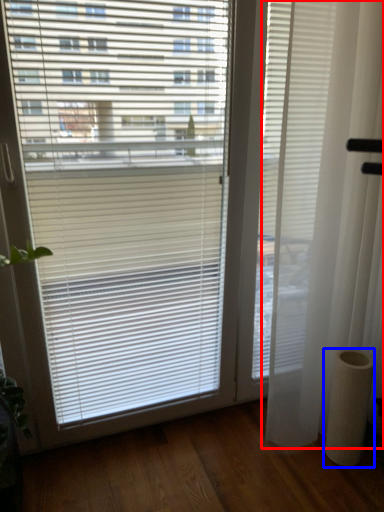
Question: Which object appears farthest to the camera in this image, curtain (highlighted by a red box) or pillar (highlighted by a blue box)?

Choices:
 (A) curtain
 (B) pillar

Answer: (B)